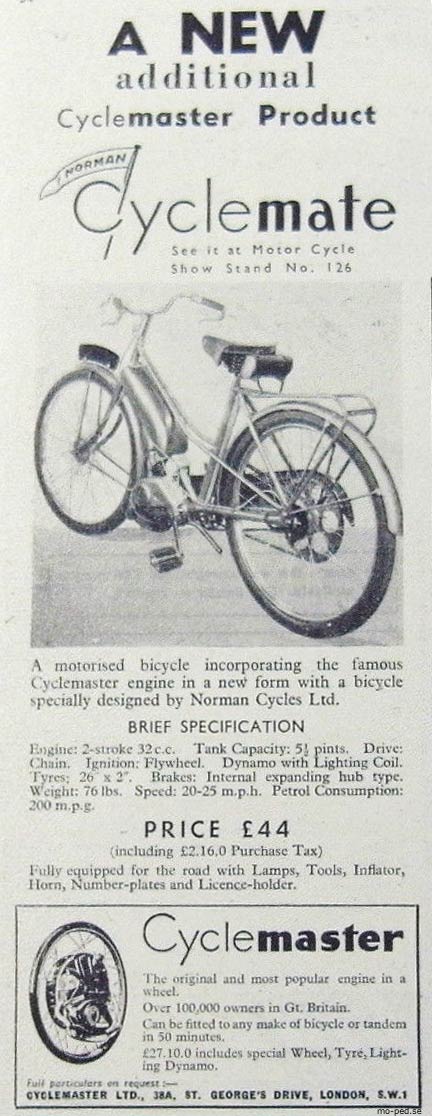
You are a GUI agent. You are given a task and a screenshot of the screen. Output one action in this format:
    pyautogui.click(x=<x>, y=<y>)
    Task: Click on the handle
    
    Given the screenshot: What is the action you would take?
    pyautogui.click(x=113, y=299)